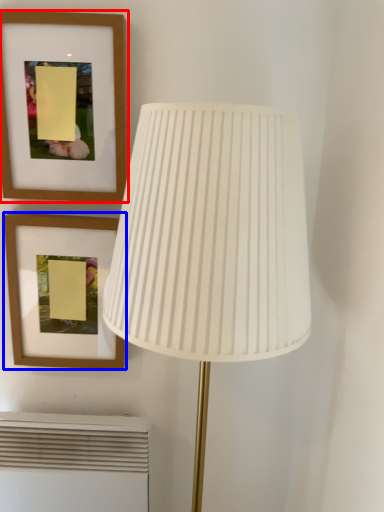
Question: Which of the following is the closest to the observer, picture frame (highlighted by a red box) or picture frame (highlighted by a blue box)?

Choices:
 (A) picture frame
 (B) picture frame

Answer: (A)